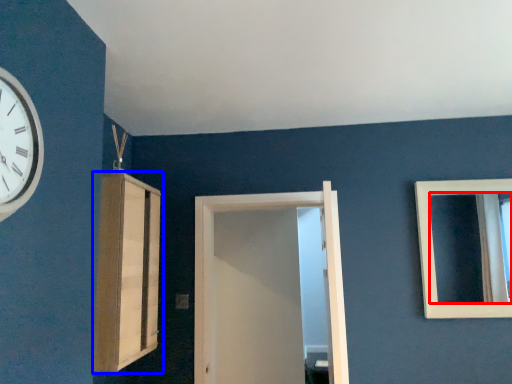
Question: Among these objects, which one is nearest to the camera, mirror (highlighted by a red box) or cabinetry (highlighted by a blue box)?

Choices:
 (A) mirror
 (B) cabinetry

Answer: (B)